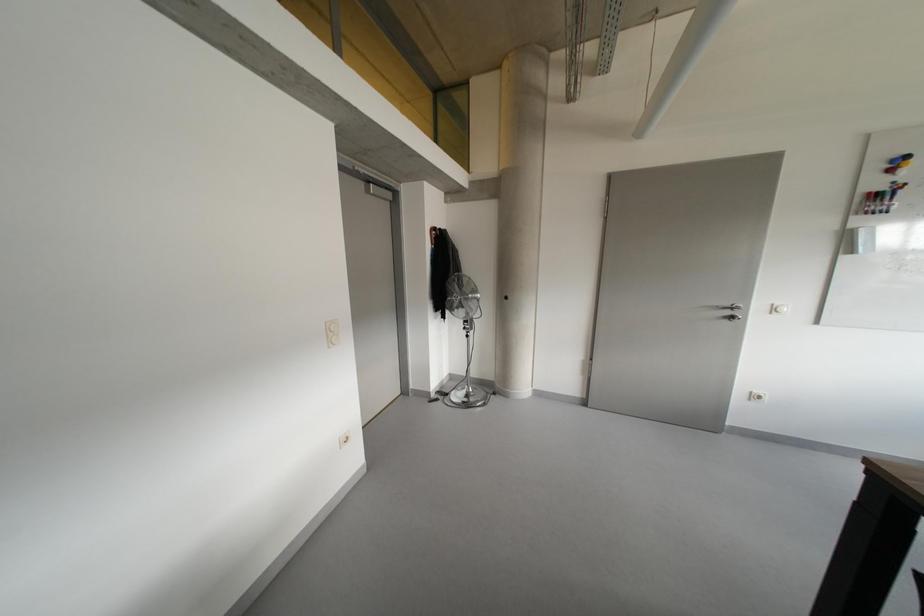
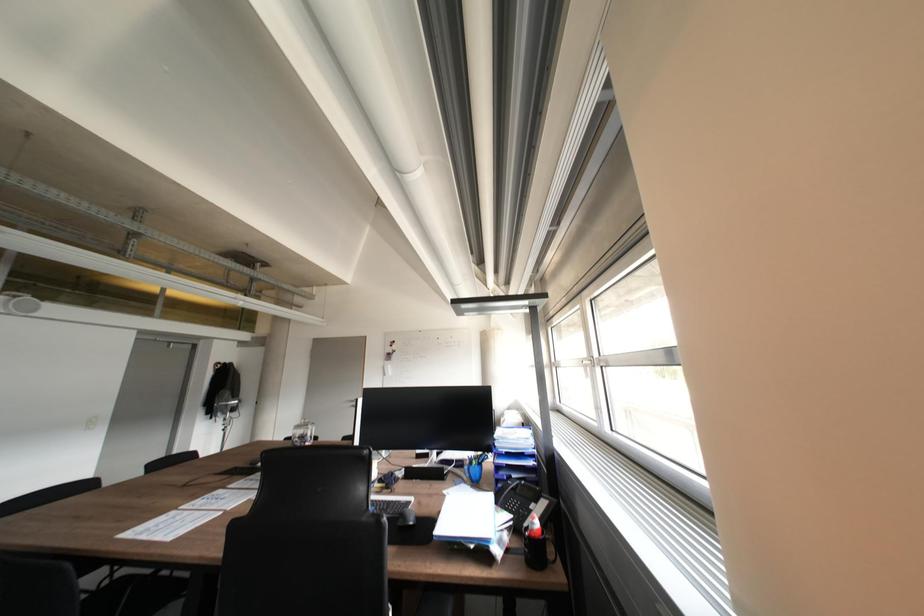
The images are taken continuously from a first-person perspective. In which direction are you moving?

The cameraman moved toward right, backward.